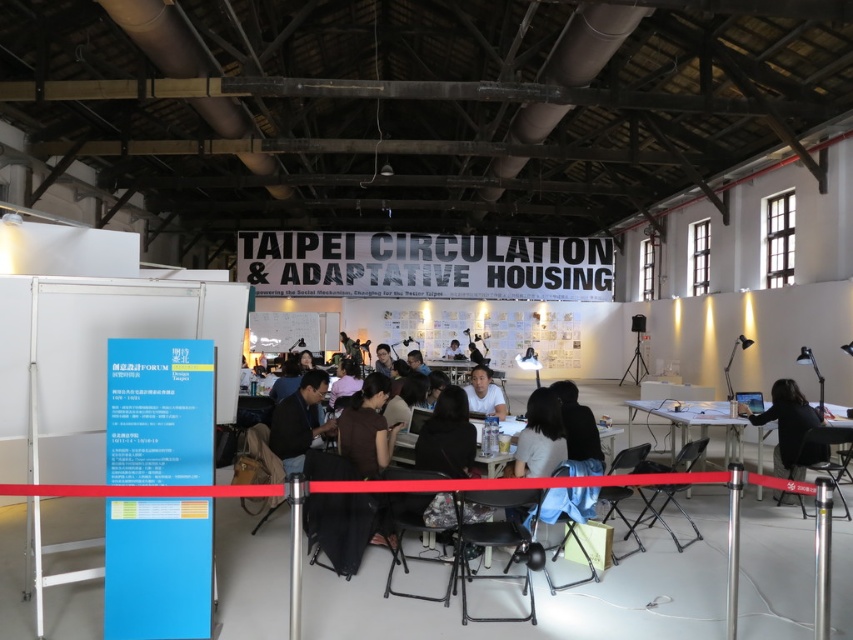
Is white plastic table at right to the left of matte black laptop at center from the viewer's perspective?

No, white plastic table at right is not to the left of matte black laptop at center.

Who is shorter, white plastic table at right or matte black laptop at center?

matte black laptop at center is shorter.

Is point (633, 413) positioned behind point (413, 360)?

Yes, point (633, 413) is behind point (413, 360).

In order to click on white plastic table at right in this screenshot , I will do `click(692, 422)`.

Between dark blue shirt at center and white matte shirt at center, which one has more height?

dark blue shirt at center

Does dark blue shirt at center have a larger size compared to white matte shirt at center?

Correct, dark blue shirt at center is larger in size than white matte shirt at center.

The width and height of the screenshot is (853, 640). Describe the element at coordinates (299, 420) in the screenshot. I see `dark blue shirt at center` at that location.

Locate an element on the screen. The width and height of the screenshot is (853, 640). dark blue shirt at center is located at coordinates coord(299,420).

Looking at this image, which of these two, matte black shirt at center or matte white shirt at center, stands taller?

matte white shirt at center is taller.

Is matte black shirt at center further to camera compared to matte white shirt at center?

No, it is not.

What are the coordinates of `matte black shirt at center` in the screenshot? It's located at (383, 358).

Identify the location of matte black shirt at center. The height and width of the screenshot is (640, 853). (383, 358).